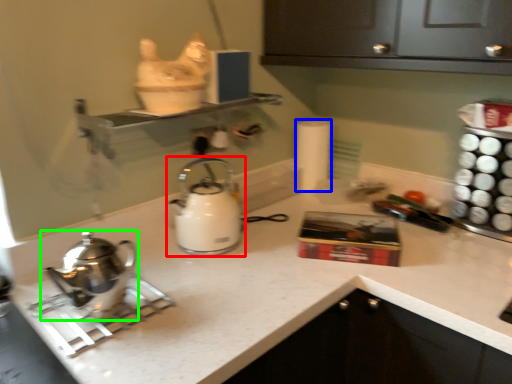
Question: Which object is the closest to the kettle (highlighted by a red box)? Choose among these: toilet paper (highlighted by a blue box) or kettle (highlighted by a green box).

Choices:
 (A) toilet paper
 (B) kettle

Answer: (B)